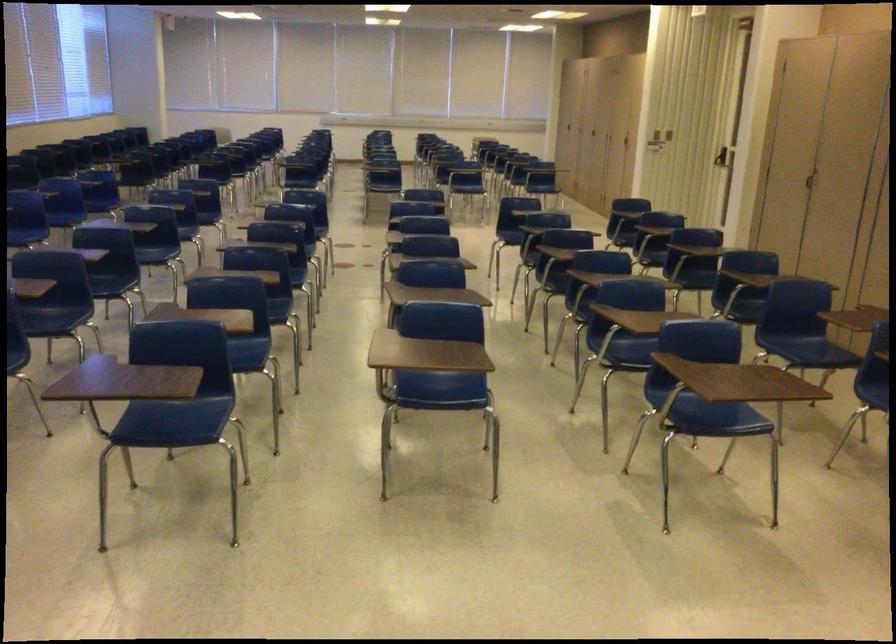
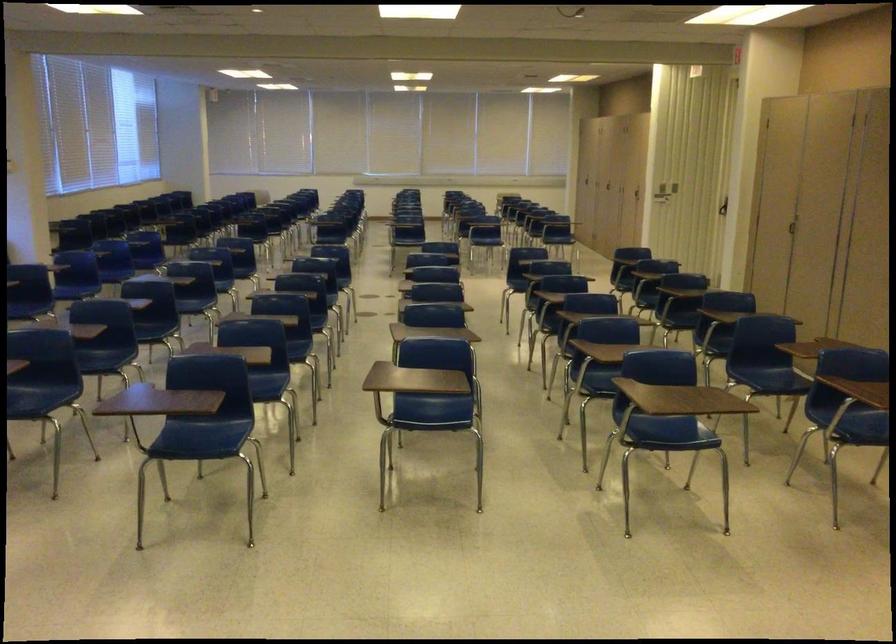
Where in the second image is the point corresponding to (x=812, y=185) from the first image?

(794, 228)